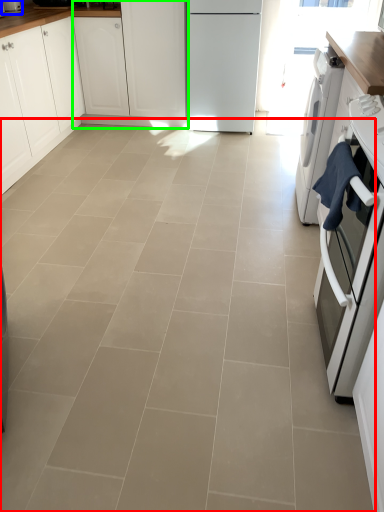
Question: Estimate the real-world distances between objects in this image. Which object is closer to ceramic tile (highlighted by a red box), kitchen appliance (highlighted by a blue box) or cabinetry (highlighted by a green box)?

Choices:
 (A) kitchen appliance
 (B) cabinetry

Answer: (B)